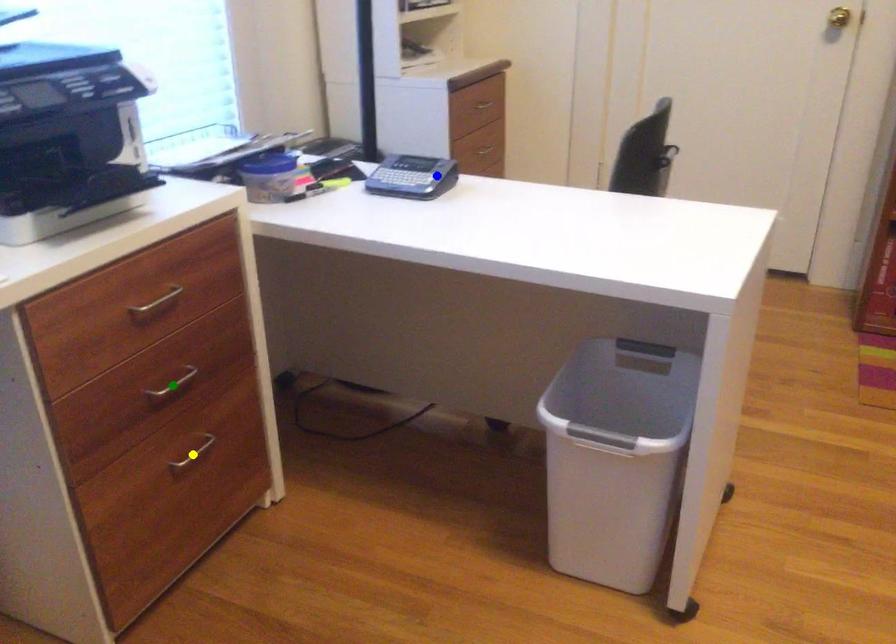
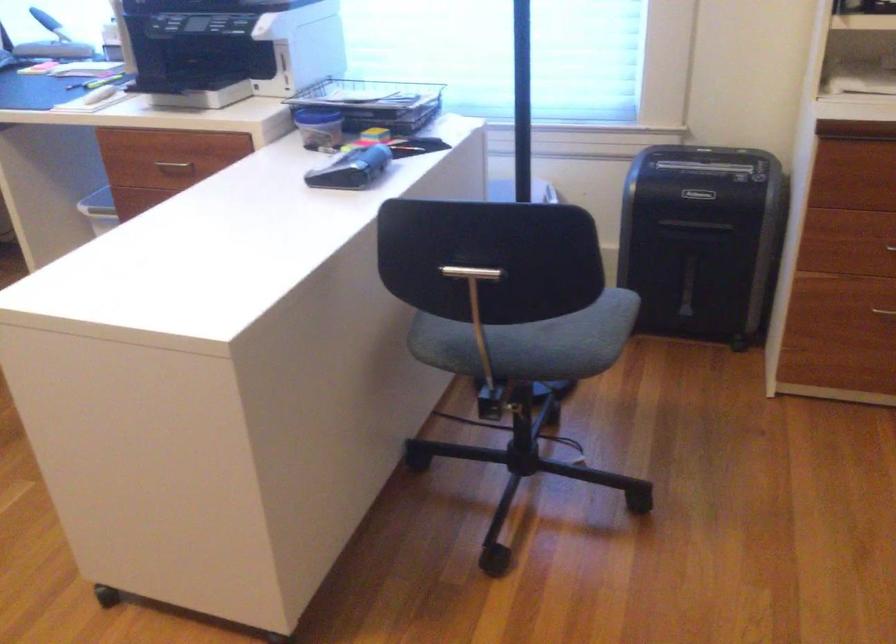
I am providing you with two images of the same scene from different viewpoints. Three points are marked in image1. Which point corresponds to a part or object that is occluded in image2?In image1, three points are marked. Which of them correspond to a part or object that is occluded in image2?Among the three points shown in image1, which one corresponds to a part or object that is no longer visible due to occlusion in image2?

yellow point, green point